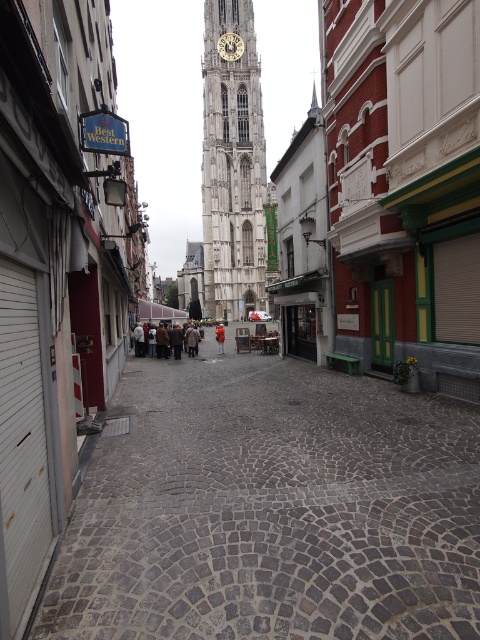
Question: Which of the following is the closest to the observer?

Choices:
 (A) white stone tower at center
 (B) orange fabric person at center

Answer: (B)

Question: Which of the following is the farthest from the observer?

Choices:
 (A) orange fabric person at center
 (B) white stone tower at center
 (C) gold textured clock at center

Answer: (C)

Question: Can you confirm if cobblestone alley at center is bigger than brown leather jacket at center?

Choices:
 (A) no
 (B) yes

Answer: (B)

Question: Considering the relative positions of stone tower at center and orange fabric person at center in the image provided, where is stone tower at center located with respect to orange fabric person at center?

Choices:
 (A) below
 (B) above

Answer: (B)

Question: From the image, what is the correct spatial relationship of cobblestone alley at center in relation to gold textured clock at center?

Choices:
 (A) below
 (B) above

Answer: (A)

Question: Which of the following is the farthest from the observer?

Choices:
 (A) (126, 529)
 (B) (229, 44)

Answer: (B)